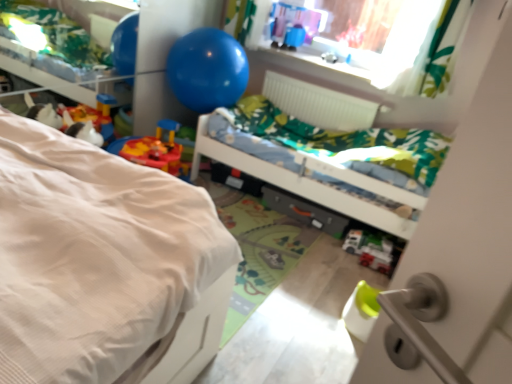
At what (x,y) coordinates should I click in order to perform the action: click on vacant space underneath matte plastic toy at upper center, which appears as the second toy when ordered from the bottom (from a real-world perspective). Please return your answer as a coordinate pair (x, y). Looking at the image, I should click on (290, 51).